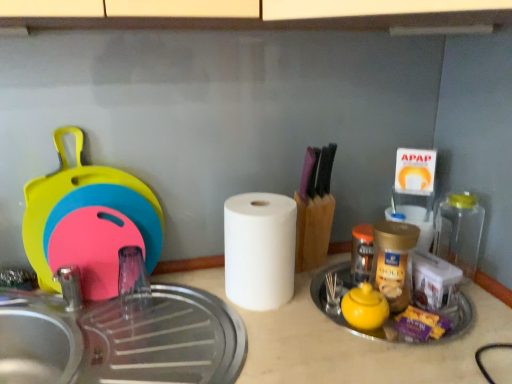
I want to click on vacant area that is in front of transparent plastic bottle at right, positioned as the 1th bottle in right-to-left order, so coord(459,311).